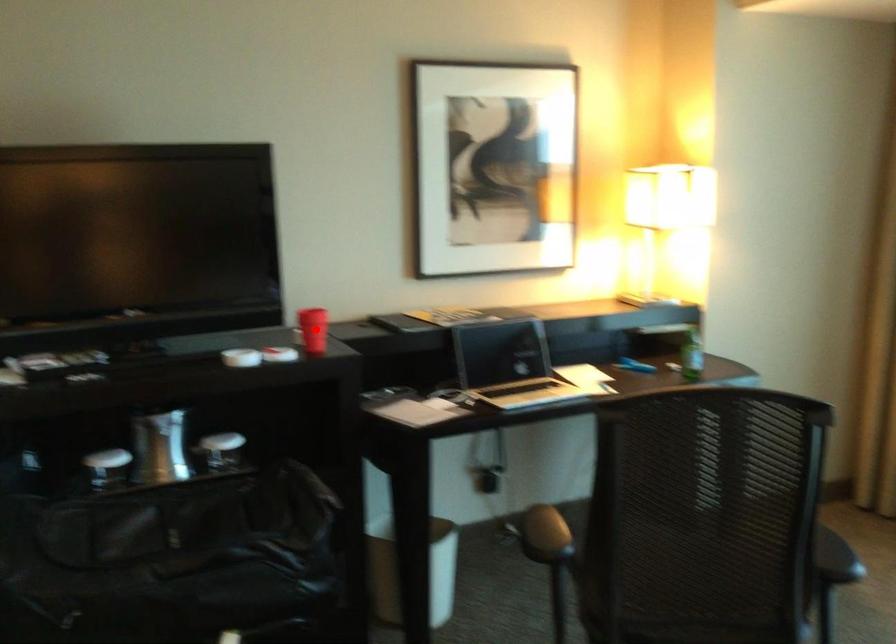
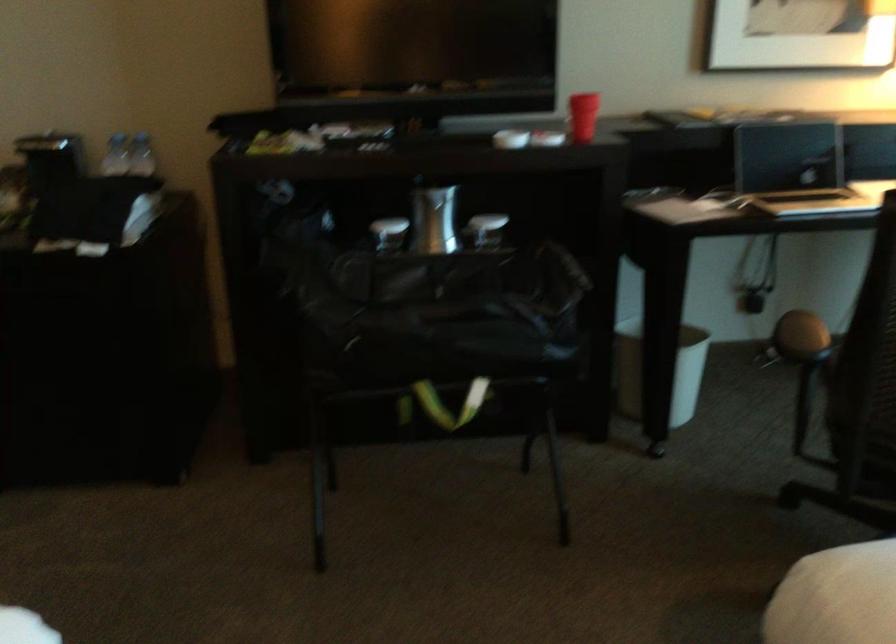
Find the pixel in the second image that matches the highlighted location in the first image.

(582, 116)